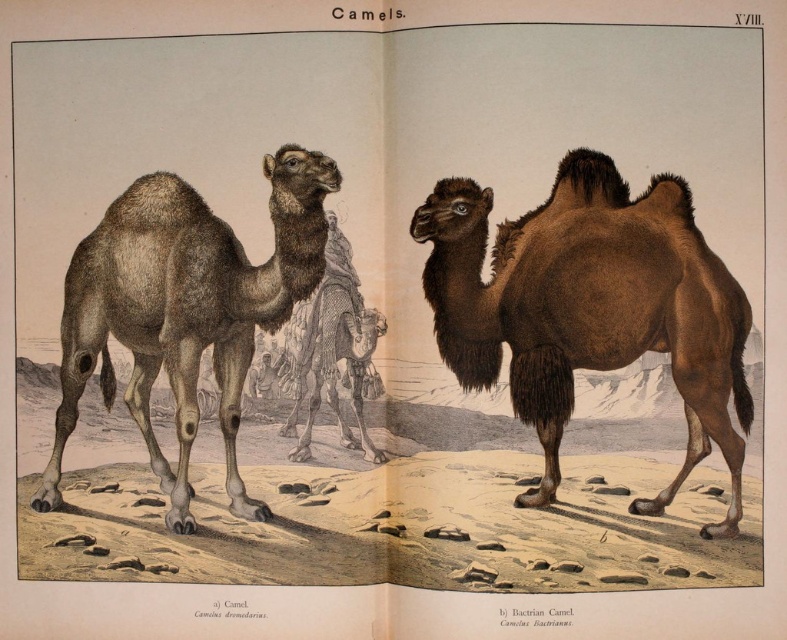
Question: Which point is farther to the camera?

Choices:
 (A) brown fuzzy camel at left
 (B) brown fuzzy bactrian camel at center

Answer: (A)

Question: From the image, what is the correct spatial relationship of brown fuzzy camel at left in relation to brown fuzzy camel at center?

Choices:
 (A) above
 (B) below

Answer: (A)

Question: Does brown fuzzy camel at left appear on the right side of brown fuzzy camel at center?

Choices:
 (A) yes
 (B) no

Answer: (B)

Question: Which object appears closest to the camera in this image?

Choices:
 (A) brown fuzzy bactrian camel at center
 (B) brown fuzzy camel at center

Answer: (A)

Question: Does brown fuzzy bactrian camel at center appear on the left side of brown fuzzy camel at center?

Choices:
 (A) yes
 (B) no

Answer: (B)

Question: Which of the following is the closest to the observer?

Choices:
 (A) (545, 300)
 (B) (69, 301)
 (C) (318, 390)

Answer: (B)